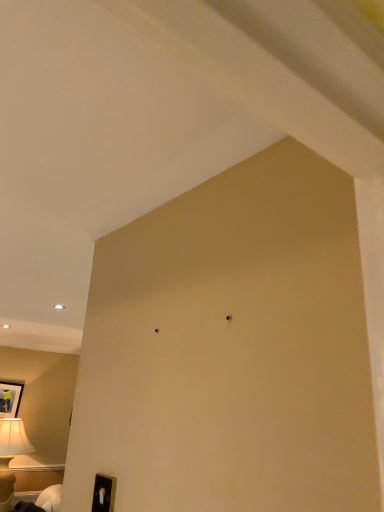
Question: From the image's perspective, is matte black picture frame at lower left above or below white glossy lampshade at lower left?

Choices:
 (A) below
 (B) above

Answer: (B)

Question: Does point (9, 410) appear closer or farther from the camera than point (39, 498)?

Choices:
 (A) farther
 (B) closer

Answer: (A)

Question: In terms of width, does matte black picture frame at lower left look wider or thinner when compared to white glossy lampshade at lower left?

Choices:
 (A) wide
 (B) thin

Answer: (B)

Question: Is white glossy lampshade at lower left taller or shorter than matte black picture frame at lower left?

Choices:
 (A) short
 (B) tall

Answer: (A)

Question: From the image's perspective, is white glossy lampshade at lower left above or below matte black picture frame at lower left?

Choices:
 (A) below
 (B) above

Answer: (A)

Question: Is white glossy lampshade at lower left bigger or smaller than matte black picture frame at lower left?

Choices:
 (A) small
 (B) big

Answer: (B)

Question: Choose the correct answer: Is white glossy lampshade at lower left inside matte black picture frame at lower left or outside it?

Choices:
 (A) outside
 (B) inside

Answer: (A)